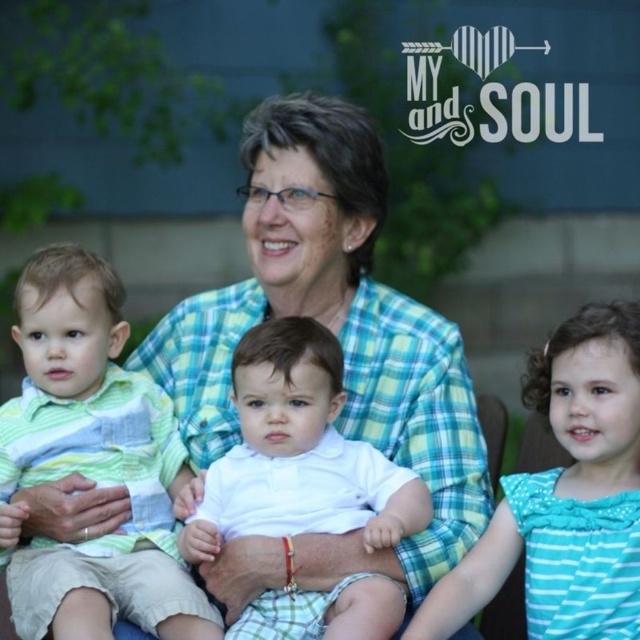
Does green striped shirt at left have a lesser width compared to white cotton shirt at center?

Yes.

Is green striped shirt at left further to camera compared to white cotton shirt at center?

Yes, it is.

What do you see at coordinates (93, 460) in the screenshot?
I see `green striped shirt at left` at bounding box center [93, 460].

Find the location of `green striped shirt at left`. green striped shirt at left is located at coordinates (93, 460).

Can you confirm if green plaid shirt at center is bigger than green striped shirt at left?

Yes.

Who is positioned more to the left, green plaid shirt at center or green striped shirt at left?

From the viewer's perspective, green striped shirt at left appears more on the left side.

Is point (301, 296) closer to viewer compared to point (42, 284)?

No, it is not.

Locate an element on the screen. green plaid shirt at center is located at coordinates (340, 344).

Describe the element at coordinates (93, 460) in the screenshot. I see `green striped shirt at left` at that location.

Between green striped shirt at left and white cotton shirt at right, which one appears on the left side from the viewer's perspective?

green striped shirt at left

You are a GUI agent. You are given a task and a screenshot of the screen. Output one action in this format:
    pyautogui.click(x=<x>, y=<y>)
    Task: Click on the green striped shirt at left
    The height and width of the screenshot is (640, 640).
    Given the screenshot: What is the action you would take?
    pyautogui.click(x=93, y=460)